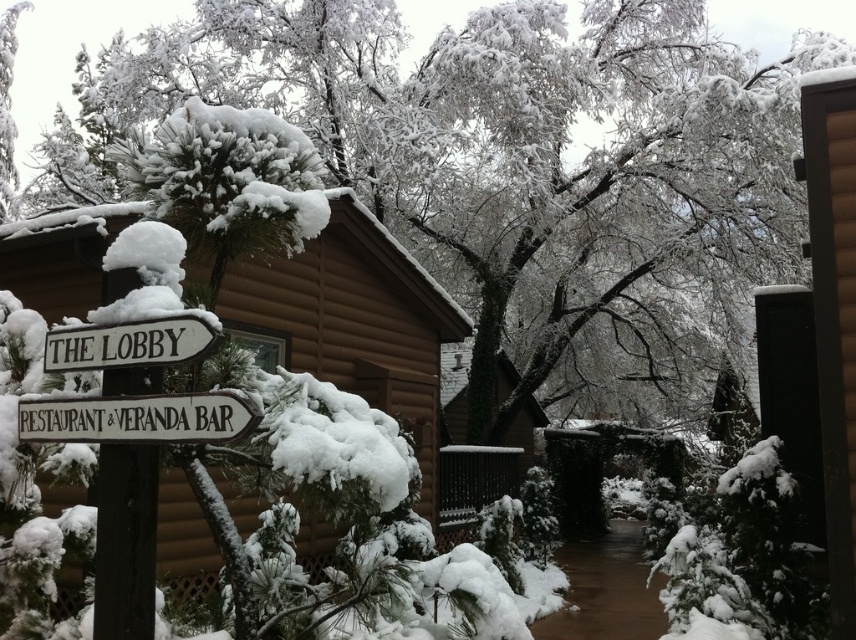
Question: Estimate the real-world distances between objects in this image. Which object is closer to the white wood signpost at left?

Choices:
 (A) wooden sign at center
 (B) white wooden sign at center

Answer: (B)

Question: Does white wooden sign at center appear on the right side of wooden sign at center?

Choices:
 (A) yes
 (B) no

Answer: (A)

Question: Does white wooden sign at center come behind wooden sign at center?

Choices:
 (A) no
 (B) yes

Answer: (A)

Question: Does white wooden sign at center have a greater width compared to wooden sign at center?

Choices:
 (A) no
 (B) yes

Answer: (B)

Question: Which of the following is the closest to the observer?

Choices:
 (A) (140, 275)
 (B) (99, 344)
 (C) (185, 419)

Answer: (C)

Question: Among these points, which one is farthest from the camera?

Choices:
 (A) pos(195,321)
 (B) pos(186,440)

Answer: (B)